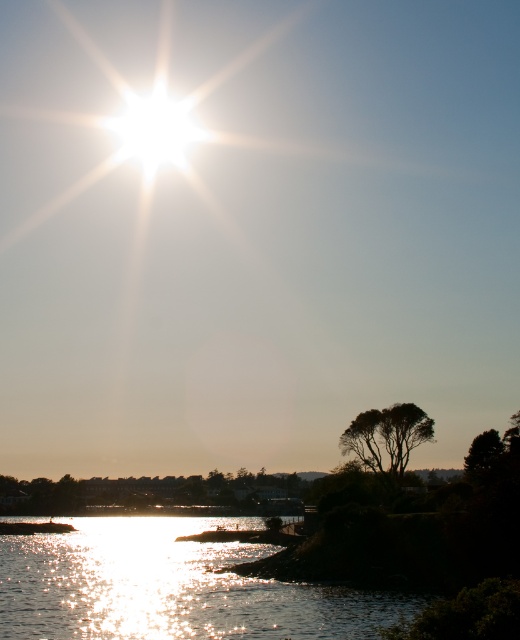
Describe the element at coordinates (386, 435) in the screenshot. The width and height of the screenshot is (520, 640). I see `silhouette leafy tree at lower right` at that location.

Does silhouette leafy tree at lower right lie in front of green matte tree at lower right?

No, silhouette leafy tree at lower right is behind green matte tree at lower right.

Does point (414, 408) come behind point (486, 444)?

Yes, it is.

Where is `silhouette leafy tree at lower right`? The height and width of the screenshot is (640, 520). silhouette leafy tree at lower right is located at coordinates (386, 435).

Between shiny reflective water at lower center and silhouette leafy tree at lower right, which one is positioned lower?

shiny reflective water at lower center is below.

Which is behind, point (157, 556) or point (346, 429)?

Point (157, 556)

This screenshot has height=640, width=520. What are the coordinates of `shiny reflective water at lower center` in the screenshot? It's located at (171, 586).

Does shiny reflective water at lower center have a lesser width compared to green matte tree at lower right?

In fact, shiny reflective water at lower center might be wider than green matte tree at lower right.

Locate an element on the screen. This screenshot has height=640, width=520. shiny reflective water at lower center is located at coordinates (171, 586).

Between point (219, 576) and point (477, 476), which one is positioned in front?

Point (477, 476) is in front.

Where is `shiny reflective water at lower center`? The image size is (520, 640). shiny reflective water at lower center is located at coordinates (171, 586).